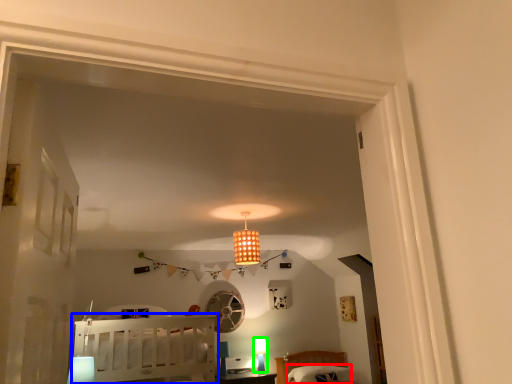
Question: Which is nearer to the pillow (highlighted by a red box)? furniture (highlighted by a blue box) or lamp (highlighted by a green box).

Choices:
 (A) furniture
 (B) lamp

Answer: (B)